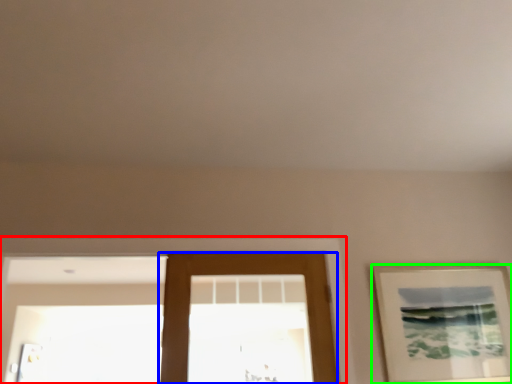
Question: Considering the real-world distances, which object is farthest from window frame (highlighted by a red box)? door (highlighted by a blue box) or picture frame (highlighted by a green box)?

Choices:
 (A) door
 (B) picture frame

Answer: (B)